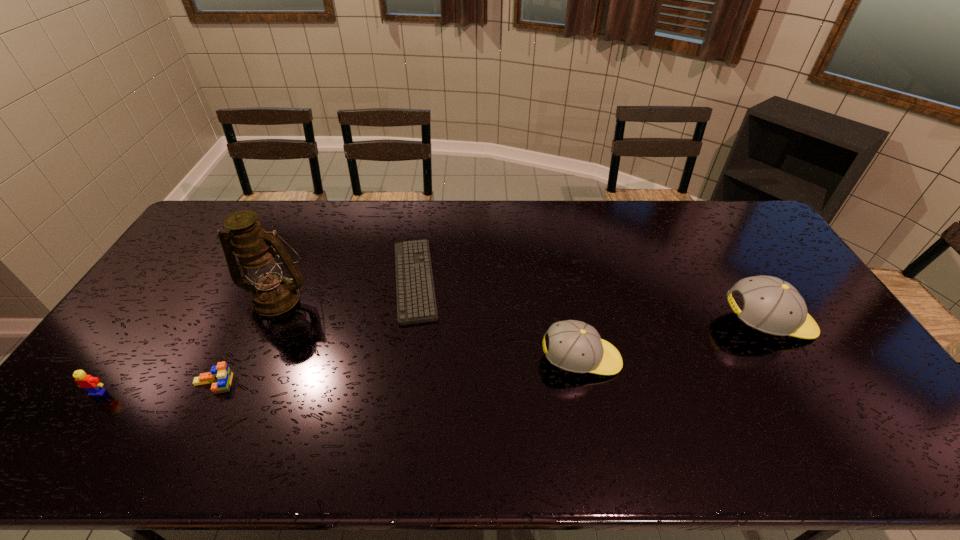
Find the location of a particular element. the left Lego is located at coordinates (92, 384).

You are a GUI agent. You are given a task and a screenshot of the screen. Output one action in this format:
    pyautogui.click(x=<x>, y=<y>)
    Task: Click on the vacant space located 0.120m on the front-facing side of the shorter baseball cap
    
    Given the screenshot: What is the action you would take?
    pyautogui.click(x=666, y=360)

You are a GUI agent. You are given a task and a screenshot of the screen. Output one action in this format:
    pyautogui.click(x=<x>, y=<y>)
    Task: Click on the free region located on the left of the fourth object from left to right
    
    Given the screenshot: What is the action you would take?
    pyautogui.click(x=307, y=280)

Locate an element on the screen. free space located on the right of the second shortest object is located at coordinates (299, 384).

Find the location of a particular element. This screenshot has height=540, width=960. free point located 0.170m on the front of the tallest object is located at coordinates (248, 364).

Find the location of `object that is at the left edge`. object that is at the left edge is located at coordinates (92, 384).

I want to click on object at the right edge, so click(x=773, y=306).

I want to click on object that is at the near left corner, so click(x=92, y=384).

What are the coordinates of `free spot at the far edge of the desktop` in the screenshot? It's located at (634, 219).

Locate an element on the screen. Image resolution: width=960 pixels, height=540 pixels. vacant space at the near edge of the desktop is located at coordinates (488, 395).